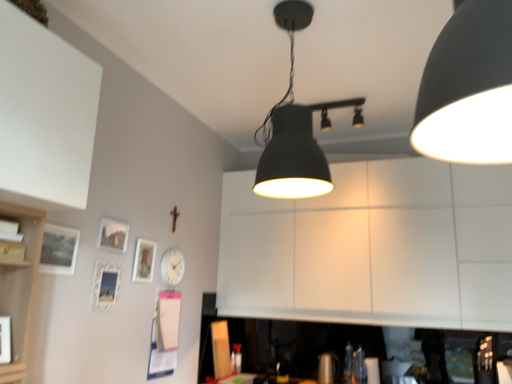
Question: Which direction should I rotate to face matte black lampshade at center, acting as the 2th lamp starting from the right, — up or down?

Choices:
 (A) up
 (B) down

Answer: (A)

Question: Are white matte cabinet at center and matte black picture frame at left, the 4th picture frame in the back-to-front sequence, far apart?

Choices:
 (A) no
 (B) yes

Answer: (B)

Question: Is white matte cabinet at center facing towards matte black picture frame at left, marked as the first picture frame in a front-to-back arrangement?

Choices:
 (A) yes
 (B) no

Answer: (A)

Question: Is white matte cabinet at center not within matte black picture frame at left, marked as the first picture frame in a front-to-back arrangement?

Choices:
 (A) no
 (B) yes

Answer: (B)

Question: From a real-world perspective, is white matte cabinet at center under matte black picture frame at left, the 4th picture frame in the back-to-front sequence?

Choices:
 (A) yes
 (B) no

Answer: (B)

Question: Does white matte cabinet at center have a greater height compared to matte black picture frame at left, the 4th picture frame in the back-to-front sequence?

Choices:
 (A) no
 (B) yes

Answer: (B)

Question: From the image's perspective, is white matte cabinet at center under matte black picture frame at left, the 4th picture frame in the back-to-front sequence?

Choices:
 (A) no
 (B) yes

Answer: (B)

Question: Are matte black track lights at upper center, arranged as the 1th lamp when viewed from the right, and matte glass picture frame at upper left, the 1th picture frame in the back-to-front sequence, beside each other?

Choices:
 (A) yes
 (B) no

Answer: (B)

Question: Could matte glass picture frame at upper left, the 1th picture frame in the back-to-front sequence, be considered to be inside matte black track lights at upper center, which is the second lamp from left to right?

Choices:
 (A) no
 (B) yes

Answer: (A)

Question: Does matte black track lights at upper center, the first lamp in the back-to-front sequence, have a lesser width compared to matte glass picture frame at upper left, the fourth picture frame positioned from the front?

Choices:
 (A) yes
 (B) no

Answer: (B)

Question: From a real-world perspective, is matte black track lights at upper center, which is the second lamp from left to right, positioned over matte glass picture frame at upper left, the fourth picture frame positioned from the front, based on gravity?

Choices:
 (A) no
 (B) yes

Answer: (B)

Question: From a real-world perspective, is matte black track lights at upper center, placed as the 2th lamp when sorted from front to back, located beneath matte glass picture frame at upper left, the fourth picture frame positioned from the front?

Choices:
 (A) yes
 (B) no

Answer: (B)

Question: Considering the relative positions of matte black track lights at upper center, arranged as the 1th lamp when viewed from the right, and matte glass picture frame at upper left, the 1th picture frame in the back-to-front sequence, in the image provided, is matte black track lights at upper center, arranged as the 1th lamp when viewed from the right, to the left of matte glass picture frame at upper left, the 1th picture frame in the back-to-front sequence, from the viewer's perspective?

Choices:
 (A) yes
 (B) no

Answer: (B)

Question: Is clear plastic bottle at lower center to the right of matte black lampshade at center, the second lamp positioned from the back, from the viewer's perspective?

Choices:
 (A) yes
 (B) no

Answer: (A)